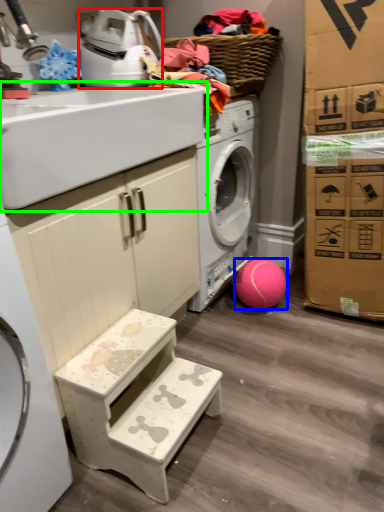
Question: Which object is the closest to the appliance (highlighted by a red box)? Choose among these: ball (highlighted by a blue box) or sink (highlighted by a green box).

Choices:
 (A) ball
 (B) sink

Answer: (B)